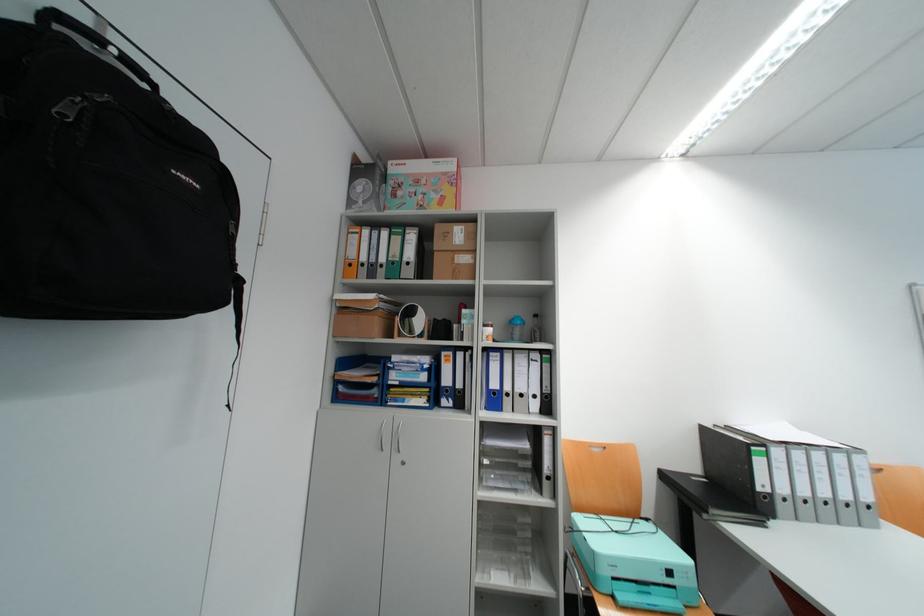
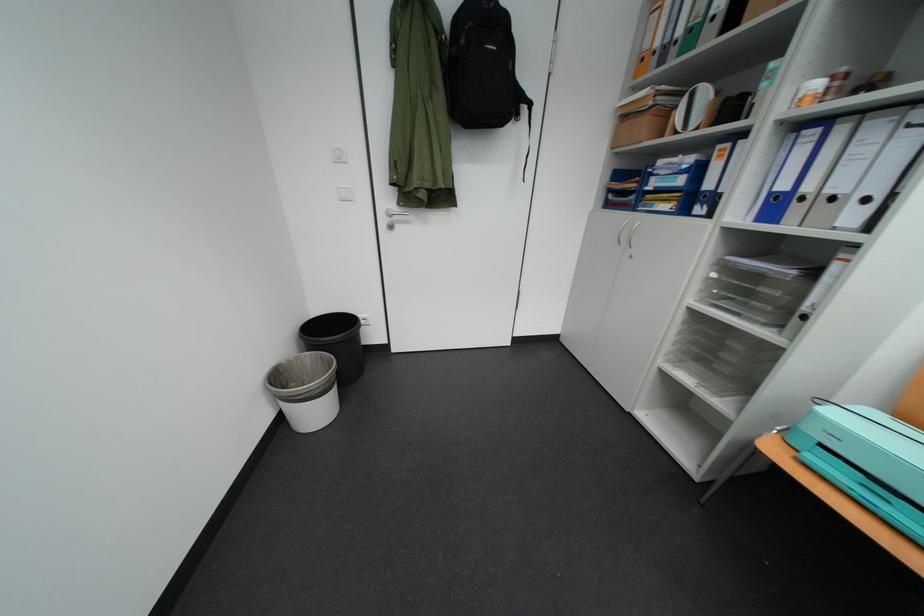
Locate, in the second image, the point that corresponds to pixel 529 392 in the first image.

(841, 193)